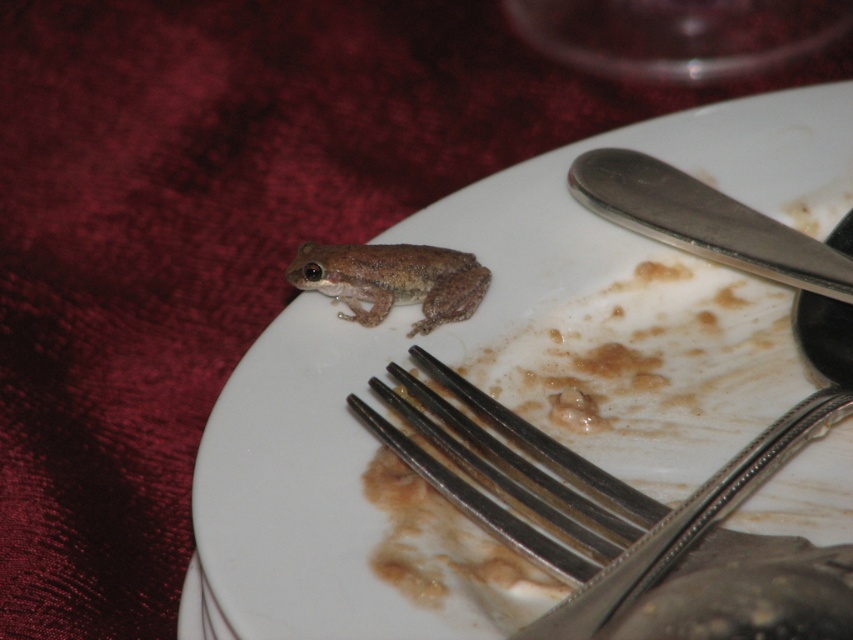
Question: Which of the following is the farthest from the observer?

Choices:
 (A) (334, 260)
 (B) (782, 257)
 (C) (577, 204)
 (D) (815, 627)

Answer: (C)

Question: Is white porcelain plate at upper left positioned in front of silver metallic fork at lower center?

Choices:
 (A) yes
 (B) no

Answer: (B)

Question: Is silver metallic fork at lower center bigger than brown matte/fuzzy frog at center?

Choices:
 (A) no
 (B) yes

Answer: (B)

Question: Which object appears farthest from the camera in this image?

Choices:
 (A) silver metallic fork at lower center
 (B) white porcelain plate at upper left

Answer: (B)

Question: Does silver metallic fork at lower center come in front of silver metallic knife at upper right?

Choices:
 (A) no
 (B) yes

Answer: (B)

Question: Among these objects, which one is farthest from the camera?

Choices:
 (A) white porcelain plate at upper left
 (B) brown matte/fuzzy frog at center
 (C) silver metallic knife at upper right
 (D) silver metallic fork at lower center

Answer: (B)